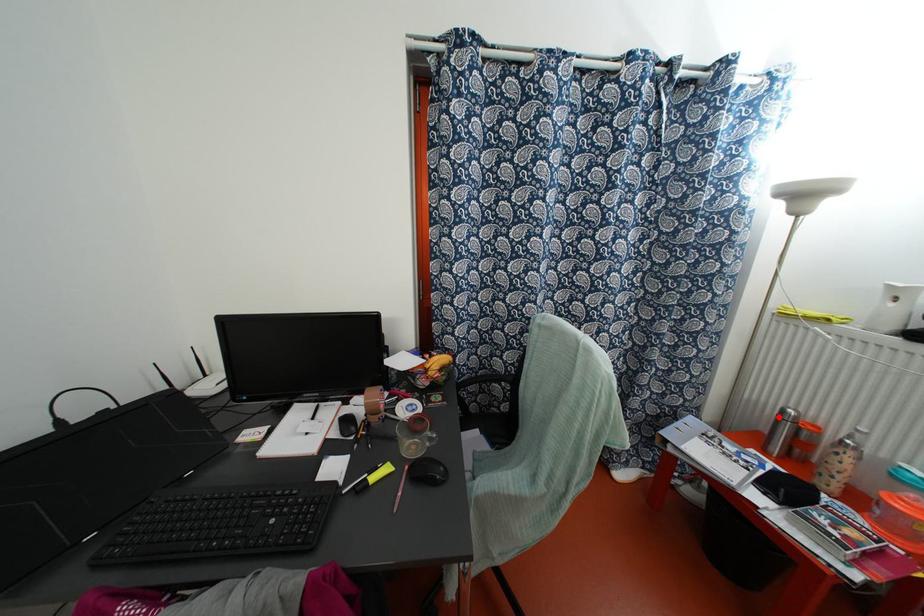
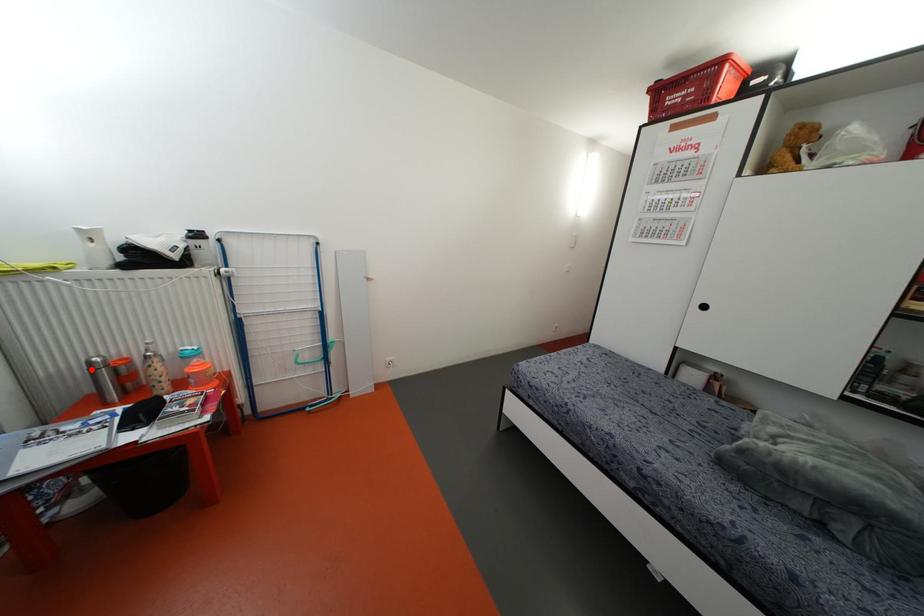
I am providing you with two images of the same scene from different viewpoints. A red point is marked on the first image and another point is marked on the second image. Does the point marked in image1 correspond to the same location as the one in image2?

Yes